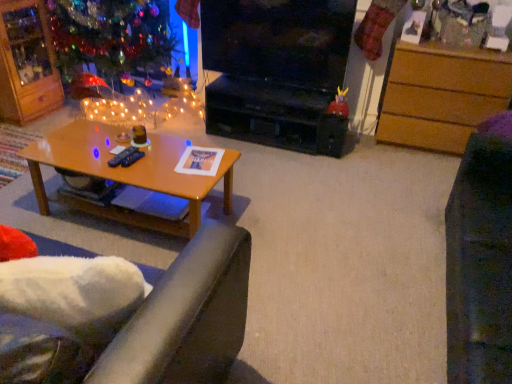
Locate an element on the screen. This screenshot has width=512, height=384. vacant area that lies in front of matte brown coffee cup at center is located at coordinates (128, 160).